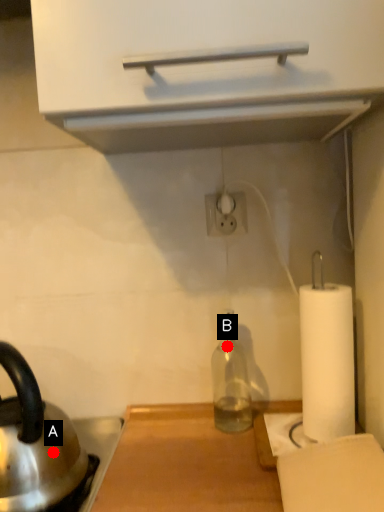
Question: Two points are circled on the image, labeled by A and B beside each circle. Which point appears closest to the camera in this image?

Choices:
 (A) A is closer
 (B) B is closer

Answer: (A)